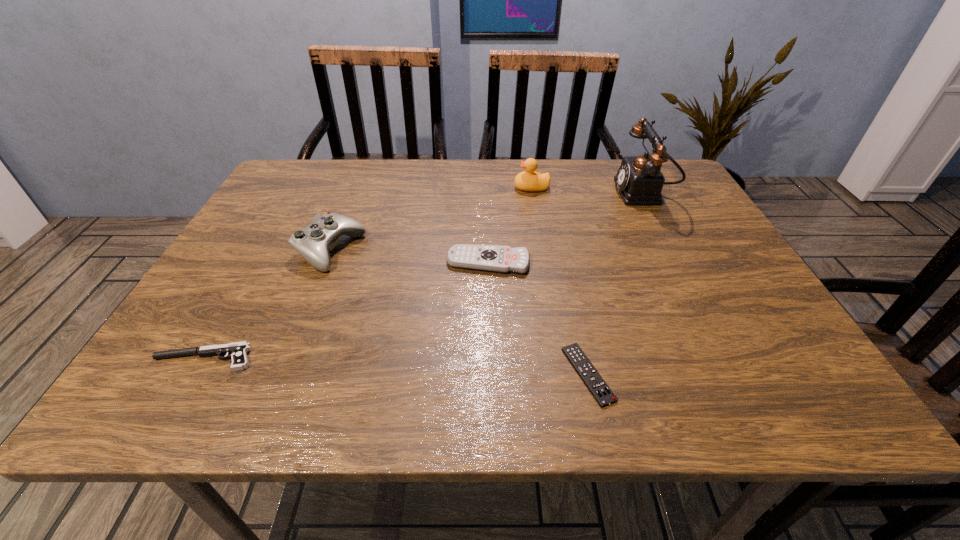
I want to click on pistol that is at the near edge, so click(x=237, y=351).

Where is `remote control that is positioned at the near edge`? The width and height of the screenshot is (960, 540). remote control that is positioned at the near edge is located at coordinates (594, 382).

The height and width of the screenshot is (540, 960). I want to click on control that is positioned at the left edge, so click(313, 243).

Where is `pistol that is positioned at the left edge`? This screenshot has width=960, height=540. pistol that is positioned at the left edge is located at coordinates (237, 351).

In order to click on object positioned at the right edge in this screenshot , I will do `click(640, 181)`.

You are a GUI agent. You are given a task and a screenshot of the screen. Output one action in this format:
    pyautogui.click(x=<x>, y=<y>)
    Task: Click on the object positioned at the near left corner
    
    Given the screenshot: What is the action you would take?
    pyautogui.click(x=237, y=351)

I want to click on object positioned at the far right corner, so click(x=640, y=181).

I want to click on vacant space at the far edge of the desktop, so click(x=547, y=164).

Find the location of a particular element. This screenshot has width=960, height=540. vacant space at the near edge of the desktop is located at coordinates (705, 391).

Where is `vacant space at the left edge of the desktop`? The width and height of the screenshot is (960, 540). vacant space at the left edge of the desktop is located at coordinates (253, 321).